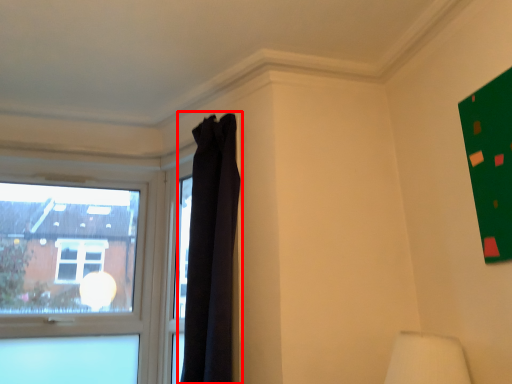
Question: From the image's perspective, considering the relative positions of curtain (annotated by the red box) and window in the image provided, where is curtain (annotated by the red box) located with respect to the staircase?

Choices:
 (A) below
 (B) above

Answer: (B)